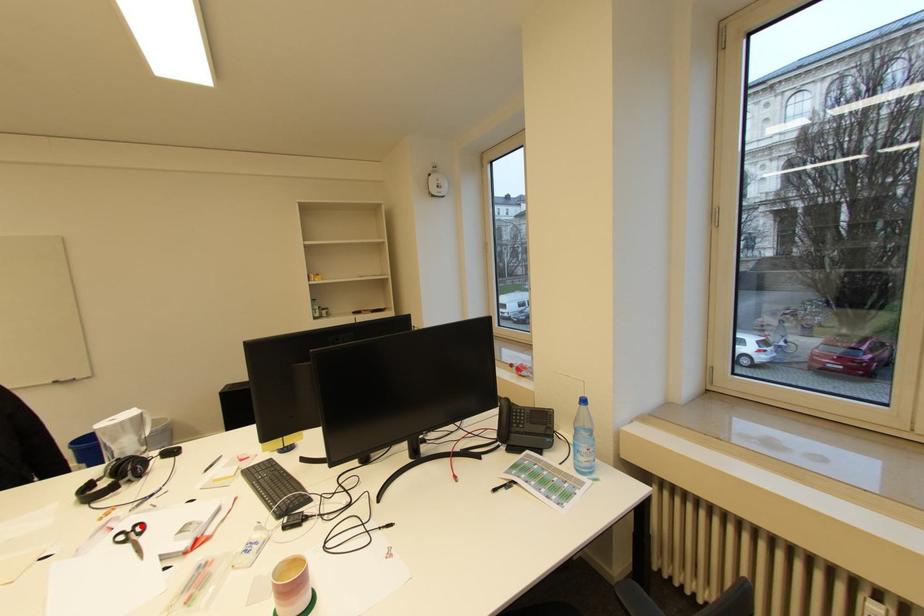
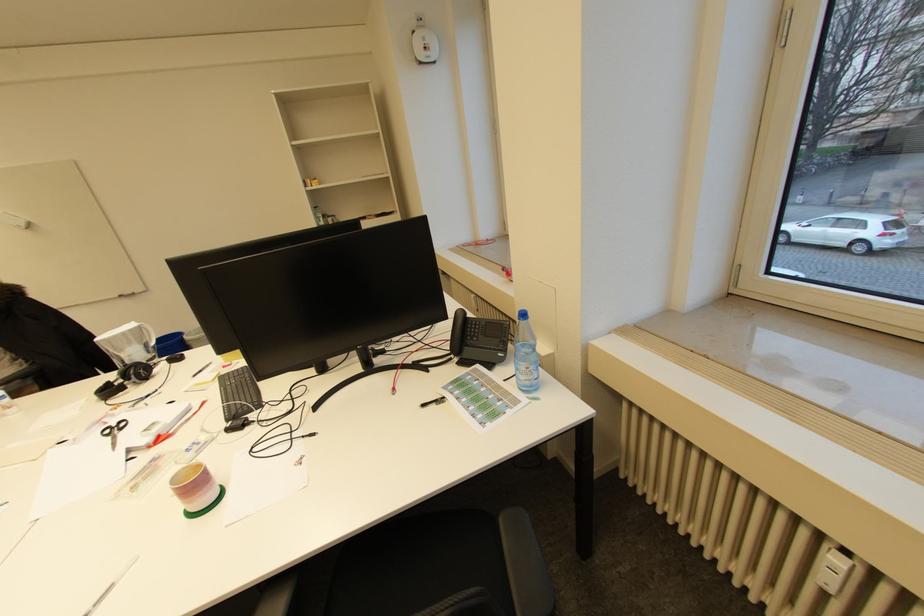
In the second image, find the point that corresponds to the highlighted location in the first image.

(127, 422)